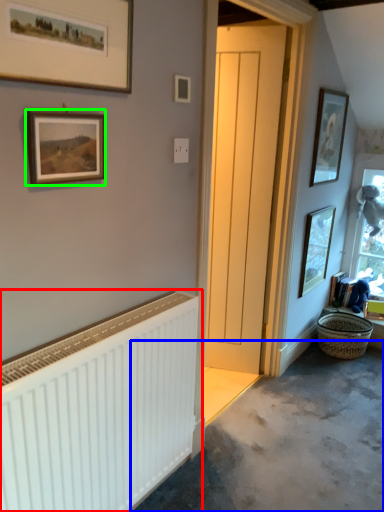
Question: Estimate the real-world distances between objects in this image. Which object is farther from radiator (highlighted by a red box), concrete (highlighted by a blue box) or picture frame (highlighted by a green box)?

Choices:
 (A) concrete
 (B) picture frame

Answer: (A)